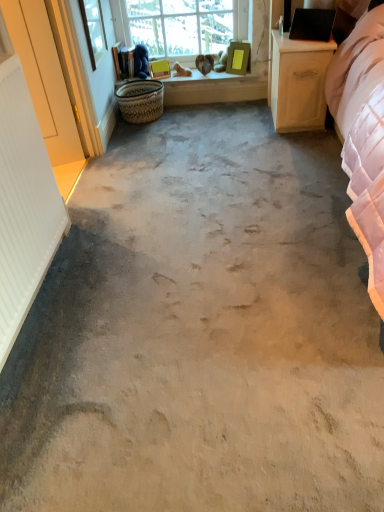
Question: Is light wood/wooden nightstand at right shorter than wooden window sill at upper center?

Choices:
 (A) no
 (B) yes

Answer: (A)

Question: Could you tell me if light wood/wooden nightstand at right is turned towards wooden window sill at upper center?

Choices:
 (A) no
 (B) yes

Answer: (A)

Question: Is light wood/wooden nightstand at right to the left of wooden window sill at upper center from the viewer's perspective?

Choices:
 (A) no
 (B) yes

Answer: (A)

Question: From the image's perspective, is light wood/wooden nightstand at right on wooden window sill at upper center?

Choices:
 (A) no
 (B) yes

Answer: (A)

Question: Is light wood/wooden nightstand at right located outside wooden window sill at upper center?

Choices:
 (A) yes
 (B) no

Answer: (A)

Question: From a real-world perspective, relative to white ribbed radiator at left, is wooden window sill at upper center vertically above or below?

Choices:
 (A) below
 (B) above

Answer: (A)

Question: Is wooden window sill at upper center in front of or behind white ribbed radiator at left in the image?

Choices:
 (A) front
 (B) behind

Answer: (B)

Question: Looking at their shapes, would you say wooden window sill at upper center is wider or thinner than white ribbed radiator at left?

Choices:
 (A) thin
 (B) wide

Answer: (B)

Question: Is wooden window sill at upper center spatially inside white ribbed radiator at left, or outside of it?

Choices:
 (A) inside
 (B) outside

Answer: (B)

Question: Considering the positions of woven natural basket at center and clear glass window at upper center in the image, is woven natural basket at center wider or thinner than clear glass window at upper center?

Choices:
 (A) wide
 (B) thin

Answer: (A)

Question: Is woven natural basket at center spatially inside clear glass window at upper center, or outside of it?

Choices:
 (A) outside
 (B) inside

Answer: (A)

Question: Is woven natural basket at center taller or shorter than clear glass window at upper center?

Choices:
 (A) tall
 (B) short

Answer: (B)

Question: Is woven natural basket at center bigger or smaller than clear glass window at upper center?

Choices:
 (A) small
 (B) big

Answer: (A)

Question: Is white wood screen door at left inside the boundaries of wooden window sill at upper center, or outside?

Choices:
 (A) inside
 (B) outside

Answer: (B)

Question: Looking at their shapes, would you say white wood screen door at left is wider or thinner than wooden window sill at upper center?

Choices:
 (A) thin
 (B) wide

Answer: (A)